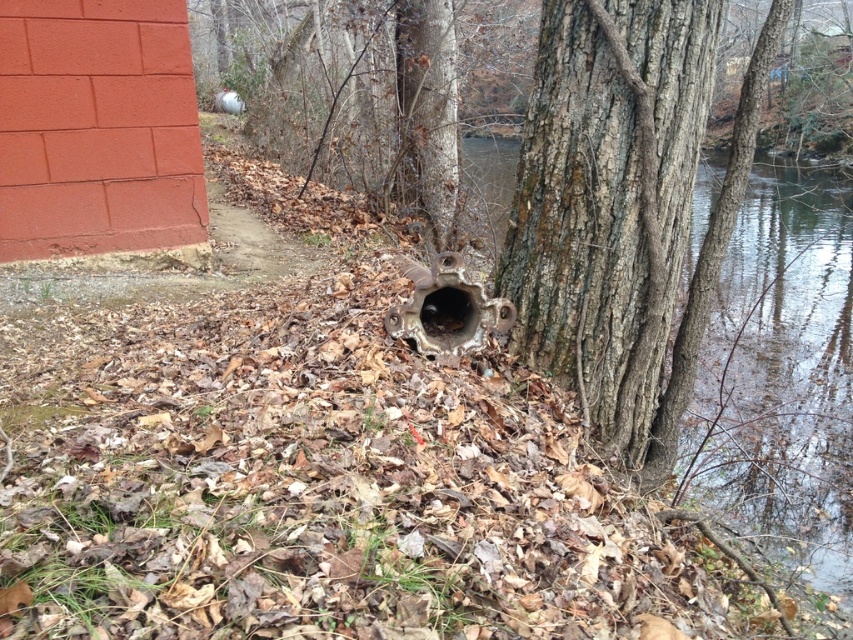
Question: Can you confirm if dark brown rough bark at center is positioned above metallic pipe at center?

Choices:
 (A) yes
 (B) no

Answer: (A)

Question: Estimate the real-world distances between objects in this image. Which object is closer to the metallic pipe at center?

Choices:
 (A) dark brown rough bark at center
 (B) transparent water at tree right

Answer: (A)

Question: Is dark brown rough bark at center wider than transparent water at tree right?

Choices:
 (A) no
 (B) yes

Answer: (A)

Question: Which point appears farthest from the camera in this image?

Choices:
 (A) pos(614,355)
 (B) pos(431,324)

Answer: (B)

Question: Can you confirm if transparent water at tree right is positioned to the right of metallic pipe at center?

Choices:
 (A) no
 (B) yes

Answer: (B)

Question: Which point is farther to the camera?

Choices:
 (A) metallic pipe at center
 (B) dark brown rough bark at center

Answer: (A)